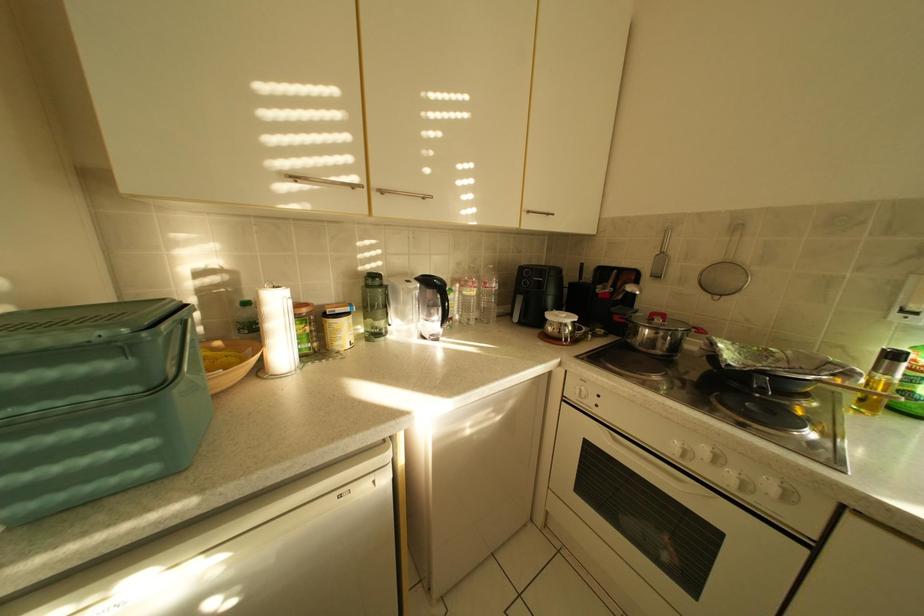
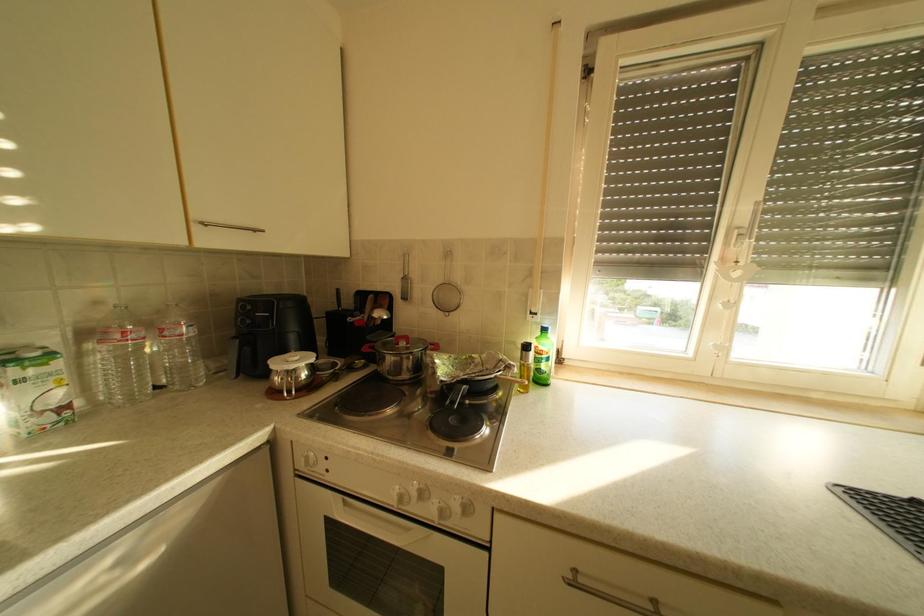
Question: The camera is either moving clockwise (left) or counter-clockwise (right) around the object. The first image is from the beginning of the video and the second image is from the end. Is the camera moving left or right when shooting the video?

Choices:
 (A) Left
 (B) Right

Answer: (A)